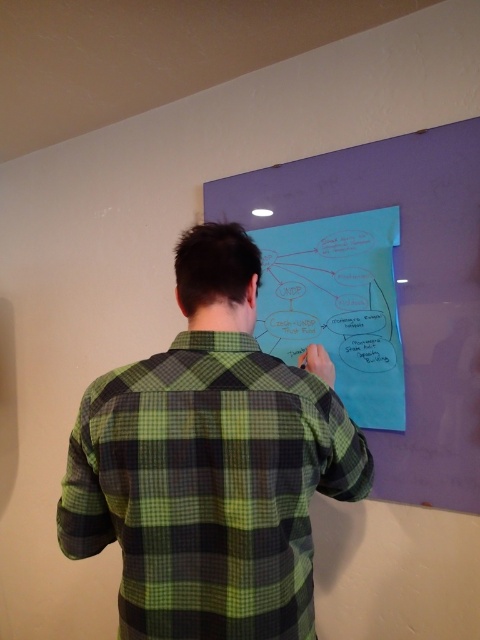
Question: Is blue paperboard at upper center above blue paper at center?

Choices:
 (A) yes
 (B) no

Answer: (A)

Question: Which object is farther from the camera taking this photo?

Choices:
 (A) blue paper at center
 (B) blue paperboard at upper center

Answer: (A)

Question: Which of the following is the farthest from the observer?

Choices:
 (A) (396, 272)
 (B) (374, 269)

Answer: (B)

Question: Considering the relative positions of green plaid shirt at center and blue paper at center in the image provided, where is green plaid shirt at center located with respect to blue paper at center?

Choices:
 (A) above
 (B) below

Answer: (B)

Question: Which is nearer to the green plaid shirt at center?

Choices:
 (A) blue paper at center
 (B) blue paperboard at upper center

Answer: (A)

Question: Is green plaid shirt at center wider than blue paperboard at upper center?

Choices:
 (A) no
 (B) yes

Answer: (A)